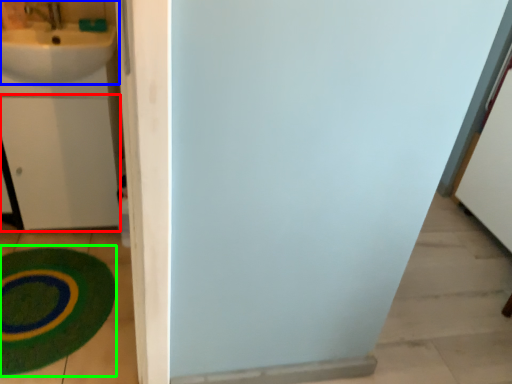
Question: Which is nearer to the drawer (highlighted by a red box)? sink (highlighted by a blue box) or bath mat (highlighted by a green box).

Choices:
 (A) sink
 (B) bath mat

Answer: (A)